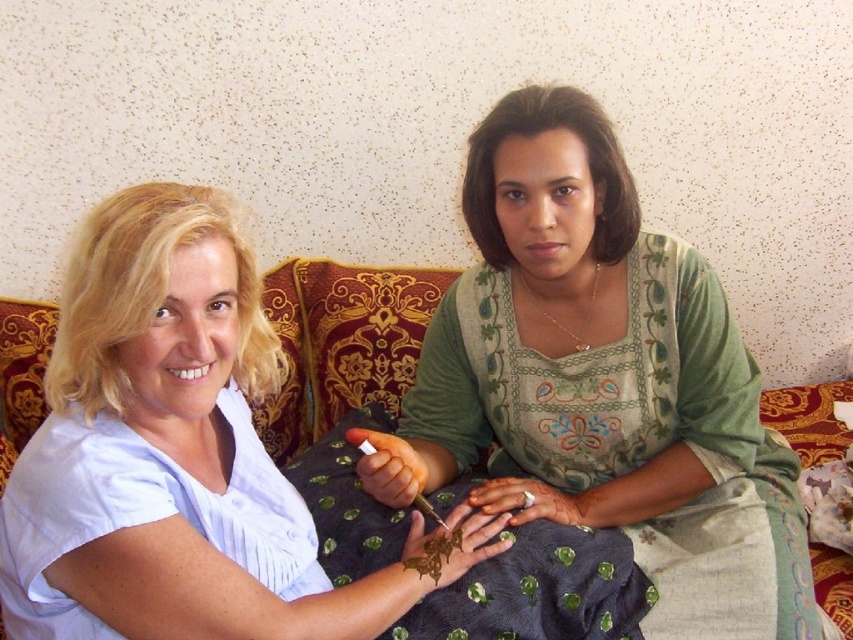
Question: Which of the following is the farthest from the observer?

Choices:
 (A) (248, 442)
 (B) (717, 317)

Answer: (B)

Question: Is green embroidered dress at center positioned behind matte white blouse at left?

Choices:
 (A) yes
 (B) no

Answer: (A)

Question: Which object is farther from the camera taking this photo?

Choices:
 (A) green embroidered dress at center
 (B) matte white blouse at left

Answer: (A)

Question: Is green embroidered dress at center smaller than matte white blouse at left?

Choices:
 (A) no
 (B) yes

Answer: (A)

Question: Does green embroidered dress at center appear under matte white blouse at left?

Choices:
 (A) no
 (B) yes

Answer: (A)